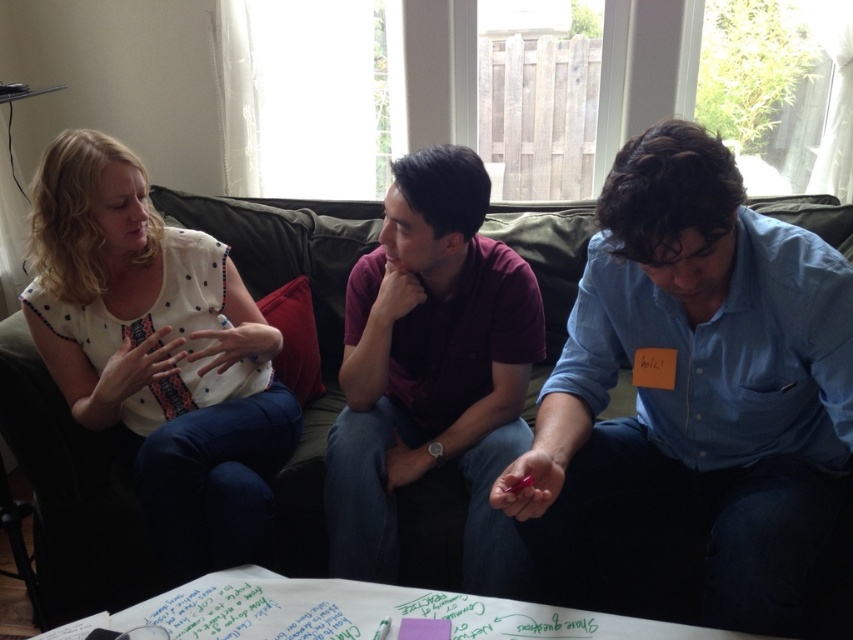
You are a photographer trying to capture a candid shot of the maroon polo shirt at center without including the green fabric couch at center in the frame. Is this possible given their positions?

The green fabric couch at center is located above the maroon polo shirt at center, so it would be difficult to capture the maroon polo shirt at center without including the couch in the frame since it is positioned above it.

What is the 2D coordinate of the green fabric couch at center?

The 2D coordinate of the green fabric couch at center is at point (71, 492).